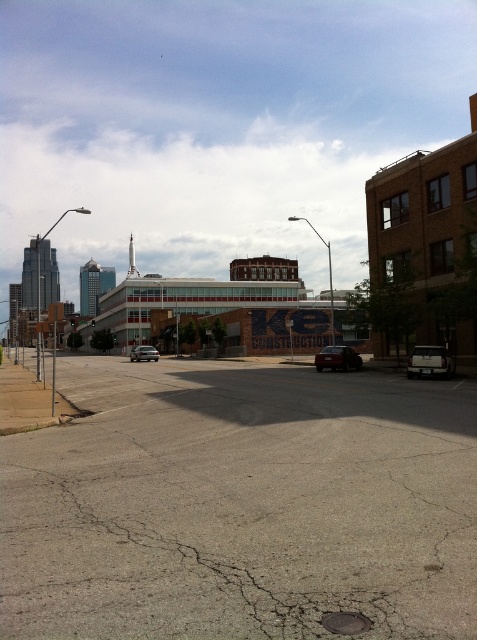
You are a pedestrian standing on the sidewalk on the left side of the street. You want to cross the road to reach the brick building on the right. Which car, the matte black car at center or the satin silver sedan at center, should you avoid walking around to stay closer to the sidewalk?

You should avoid walking around the satin silver sedan at center because the matte black car at center is to the right of it, meaning the satin silver sedan is closer to the sidewalk. Staying near the sidewalk means avoiding the car closer to it, which is the satin silver sedan at center.

You are a delivery person trying to load a tall package into your vehicle. You have two cars available in the scene, the matte black car at center and the satin silver sedan at center. Which car should you choose to ensure the package fits inside the vehicle?

The satin silver sedan at center has a greater height than the matte black car at center, so the satin silver sedan at center is the better choice to accommodate the tall package.